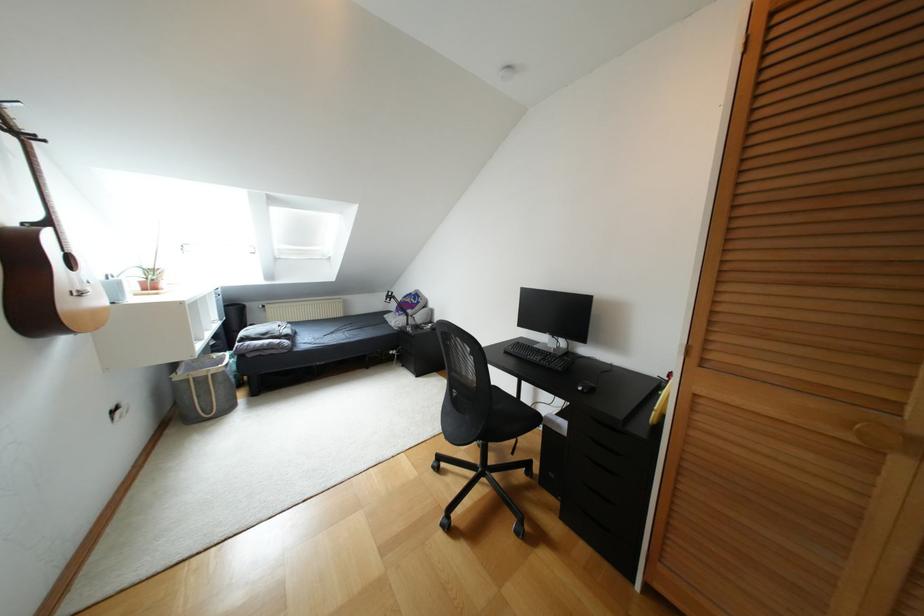
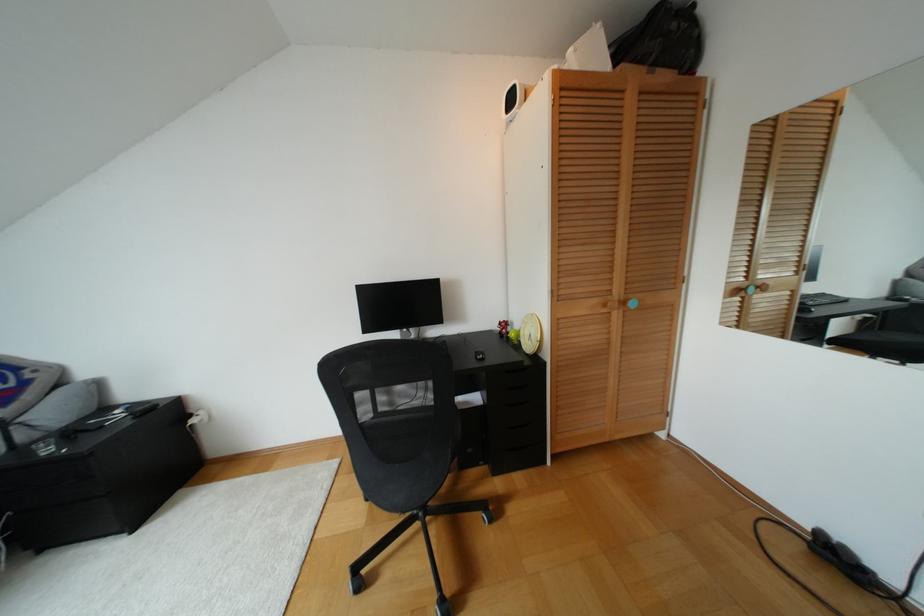
The point at (435, 468) is marked in the first image. Where is the corresponding point in the second image?

(359, 585)